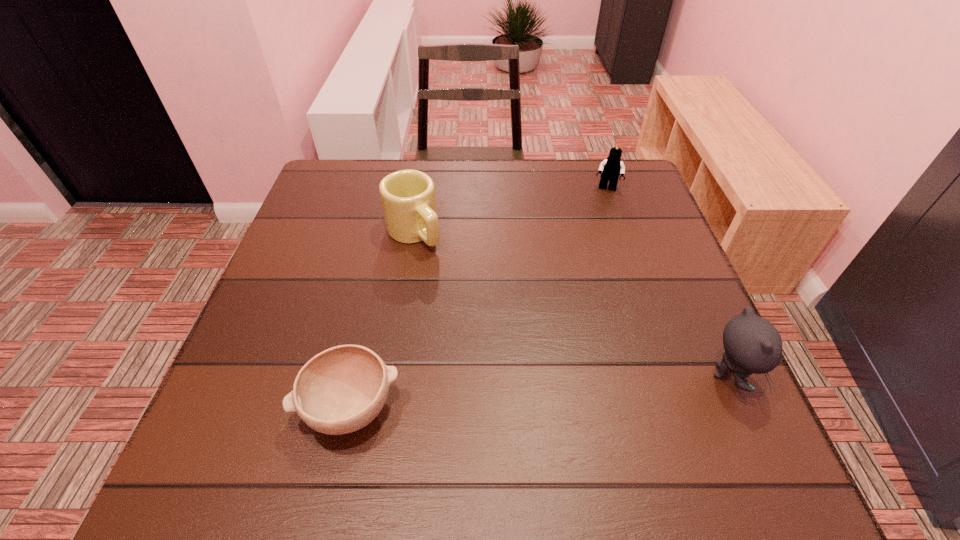
What are the coordinates of `the shortest object` in the screenshot? It's located at (342, 389).

Where is `kitten`? The width and height of the screenshot is (960, 540). kitten is located at coordinates (752, 344).

Where is `the third object from left to right`? This screenshot has width=960, height=540. the third object from left to right is located at coordinates point(611,168).

This screenshot has height=540, width=960. Identify the location of Lego. (611, 168).

Identify the location of mug. This screenshot has height=540, width=960. (408, 200).

At what (x,y) coordinates should I click in order to perform the action: click on free space located on the right of the shortest object. Please return your answer as a coordinate pair (x, y). Image resolution: width=960 pixels, height=540 pixels. Looking at the image, I should click on point(517,408).

Locate an element on the screen. The height and width of the screenshot is (540, 960). free location located on the front-facing side of the third object from left to right is located at coordinates (601, 237).

Where is `vacant area situated 0.090m on the front-facing side of the third object from left to right`? The image size is (960, 540). vacant area situated 0.090m on the front-facing side of the third object from left to right is located at coordinates (603, 215).

You are a GUI agent. You are given a task and a screenshot of the screen. Output one action in this format:
    pyautogui.click(x=<x>, y=<y>)
    Task: Click on the vacant point located 0.140m on the front-facing side of the third object from left to right
    The height and width of the screenshot is (540, 960).
    Given the screenshot: What is the action you would take?
    pyautogui.click(x=602, y=227)

Find the location of `vacant region located 0.160m with the handle on the side of the mug`. vacant region located 0.160m with the handle on the side of the mug is located at coordinates (467, 292).